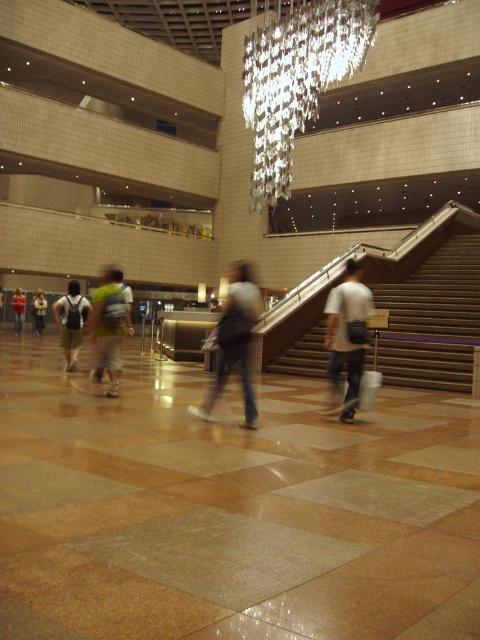
Question: Which object is closer to the camera taking this photo?

Choices:
 (A) white matte shirt at center
 (B) red shirt at lower left
 (C) matte black backpack at center

Answer: (A)

Question: Does light brown leather jacket at lower left appear on the left side of light brown leather backpack at lower left?

Choices:
 (A) no
 (B) yes

Answer: (A)

Question: Which object appears closest to the camera in this image?

Choices:
 (A) white fabric bag at center
 (B) light brown leather jacket at lower left
 (C) red shirt at lower left
 (D) light brown leather backpack at lower left

Answer: (A)

Question: Is clear crystal chandelier at upper center to the right of white matte shirt at center from the viewer's perspective?

Choices:
 (A) yes
 (B) no

Answer: (A)

Question: Does clear crystal chandelier at upper center have a lesser width compared to light brown leather jacket at lower left?

Choices:
 (A) no
 (B) yes

Answer: (A)

Question: Which point is closer to the camera?

Choices:
 (A) red shirt at lower left
 (B) light brown leather backpack at lower left
 (C) light brown leather jacket at lower left
 (D) matte black backpack at center

Answer: (D)